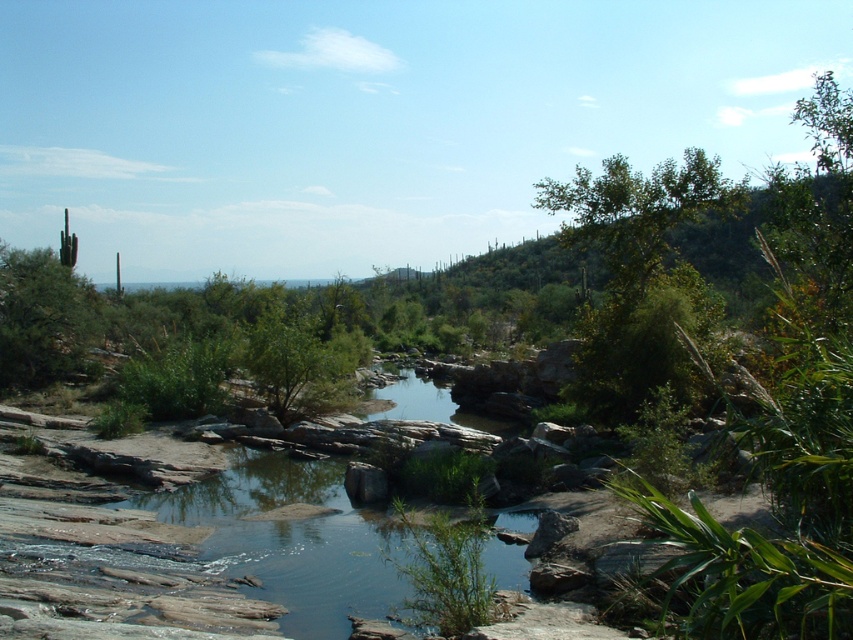
Does point (625, 397) lie behind point (3, 340)?

No, (625, 397) is closer to viewer.

Which of these two, green leafy tree at upper right or green spiky cactus at upper left, stands shorter?

green spiky cactus at upper left

Between point (611, 307) and point (49, 285), which one is positioned in front?

Point (611, 307) is more forward.

Where is `green leafy tree at upper right`? The image size is (853, 640). green leafy tree at upper right is located at coordinates (634, 273).